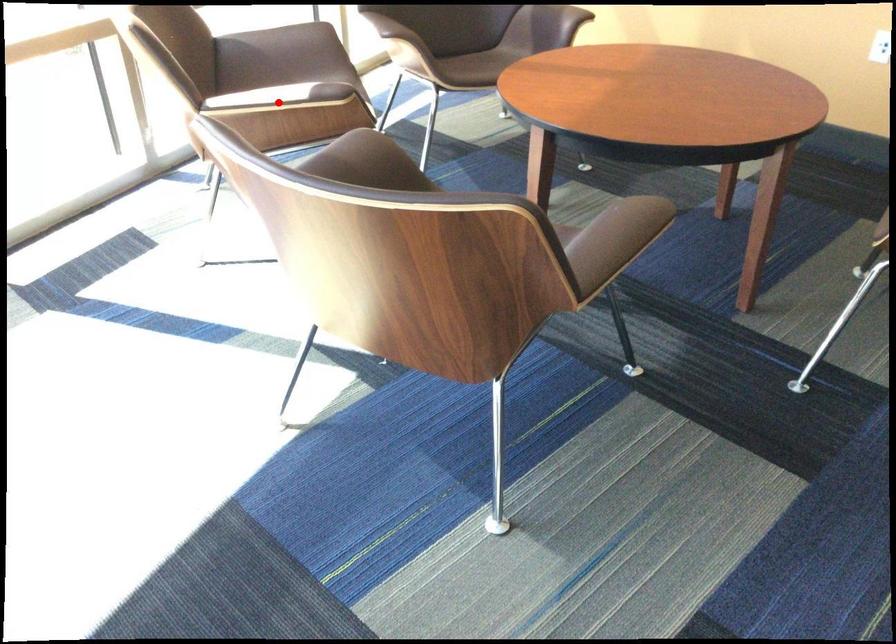
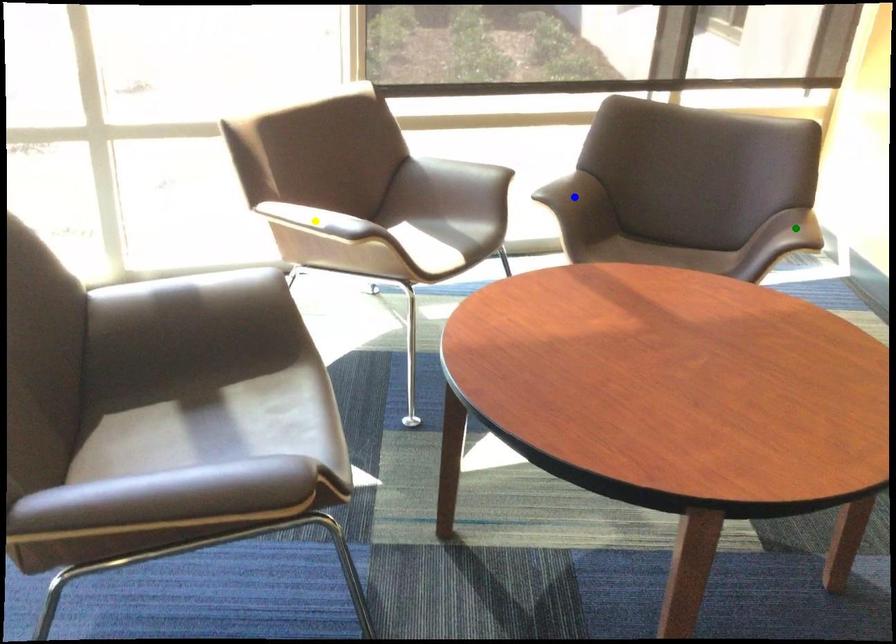
Question: I am providing you with two images of the same scene from different viewpoints. A red point is marked on the first image. You are given multiple points on the second image. Which spot in image 2 lines up with the point in image 1?

Choices:
 (A) yellow point
 (B) blue point
 (C) green point

Answer: (A)